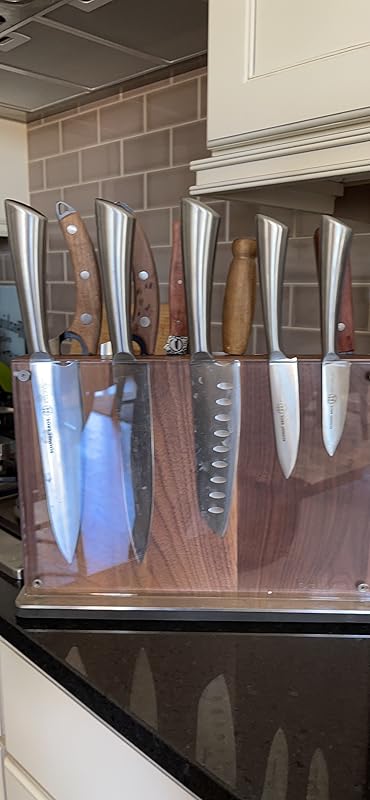
Where is `tile backsplash`? The width and height of the screenshot is (370, 800). tile backsplash is located at coordinates (141, 150).